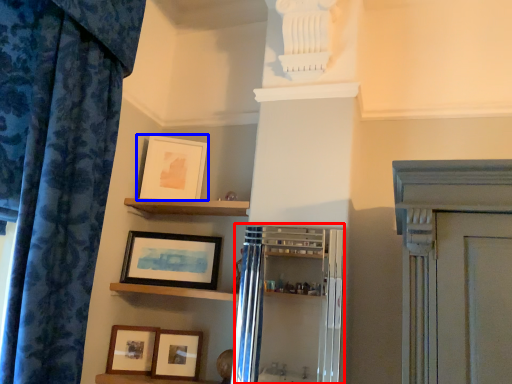
Question: Among these objects, which one is farthest to the camera, cabinetry (highlighted by a red box) or picture frame (highlighted by a blue box)?

Choices:
 (A) cabinetry
 (B) picture frame

Answer: (B)